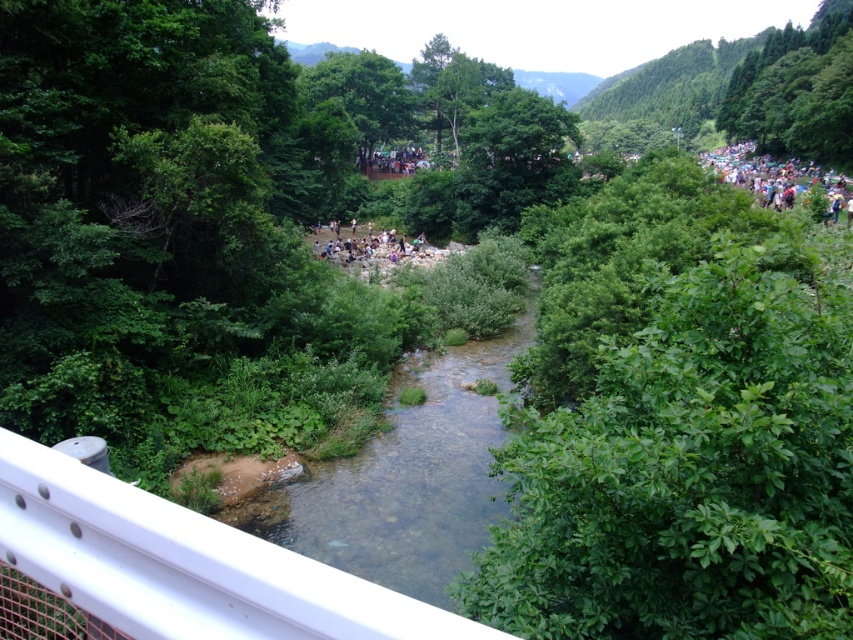
Question: Can you confirm if white metallic rail at lower left is thinner than green leafy tree at center?

Choices:
 (A) no
 (B) yes

Answer: (B)

Question: Is green leafy tree at center below multicolored fabric crowd at upper right?

Choices:
 (A) no
 (B) yes

Answer: (A)

Question: Which is nearer to the green leafy tree at center?

Choices:
 (A) clear water at center
 (B) multicolored fabric crowd at upper right
 (C) dark green foliage at center

Answer: (C)

Question: Which object is farther from the camera taking this photo?

Choices:
 (A) multicolored fabric crowd at upper right
 (B) green leafy tree at center
 (C) dark green foliage at center

Answer: (C)

Question: Is white metallic rail at lower left to the left of clear water at center from the viewer's perspective?

Choices:
 (A) no
 (B) yes

Answer: (B)

Question: Which of the following is the farthest from the observer?

Choices:
 (A) white metallic rail at lower left
 (B) green leafy tree at center
 (C) multicolored fabric crowd at upper right
 (D) clear water at center

Answer: (B)